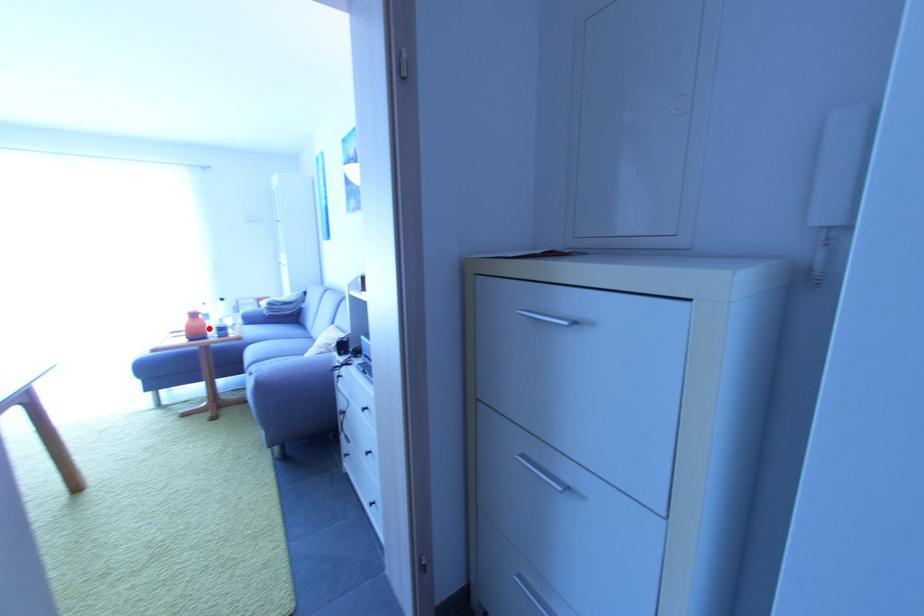
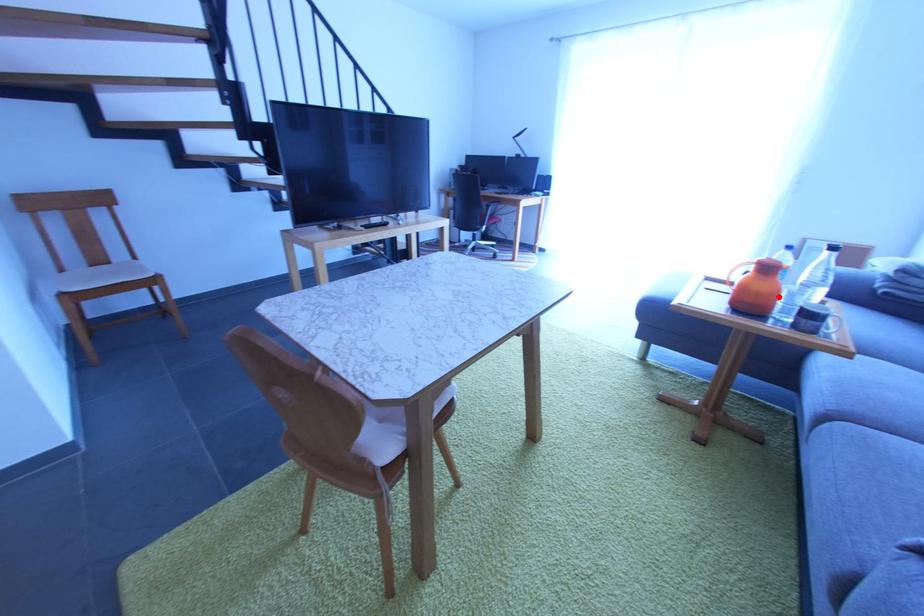
I am providing you with two images of the same scene from different viewpoints. A red point is marked on the first image and another point is marked on the second image. Do the highlighted points in image1 and image2 indicate the same real-world spot?

Yes